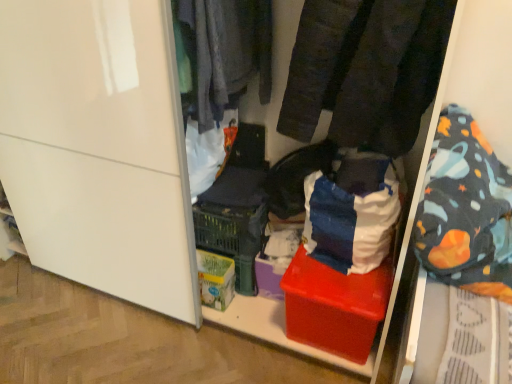
Question: From the image's perspective, is velvet-like black pants at center, the second clothing when ordered from left to right, below dark gray fabric at upper center, which appears as the 2th clothing when viewed from the right?

Choices:
 (A) no
 (B) yes

Answer: (B)

Question: Are velvet-like black pants at center, the 1th clothing viewed from the right, and dark gray fabric at upper center, the first clothing in the left-to-right sequence, beside each other?

Choices:
 (A) no
 (B) yes

Answer: (A)

Question: Is velvet-like black pants at center, the second clothing when ordered from left to right, wider than dark gray fabric at upper center, which appears as the 2th clothing when viewed from the right?

Choices:
 (A) yes
 (B) no

Answer: (A)

Question: Is velvet-like black pants at center, the second clothing when ordered from left to right, bigger than dark gray fabric at upper center, the first clothing in the left-to-right sequence?

Choices:
 (A) yes
 (B) no

Answer: (A)

Question: Does velvet-like black pants at center, the second clothing when ordered from left to right, have a lesser height compared to dark gray fabric at upper center, which appears as the 2th clothing when viewed from the right?

Choices:
 (A) yes
 (B) no

Answer: (B)

Question: In terms of height, does red plastic box at center look taller or shorter compared to velvet-like black pants at center, the 1th clothing viewed from the right?

Choices:
 (A) short
 (B) tall

Answer: (A)

Question: In terms of width, does red plastic box at center look wider or thinner when compared to velvet-like black pants at center, the 1th clothing viewed from the right?

Choices:
 (A) thin
 (B) wide

Answer: (B)

Question: From a real-world perspective, relative to velvet-like black pants at center, the 1th clothing viewed from the right, is red plastic box at center vertically above or below?

Choices:
 (A) above
 (B) below

Answer: (B)

Question: Is red plastic box at center situated inside velvet-like black pants at center, the 1th clothing viewed from the right, or outside?

Choices:
 (A) outside
 (B) inside

Answer: (A)

Question: Is red plastic box at center to the left or to the right of red plastic storage bin at center in the image?

Choices:
 (A) left
 (B) right

Answer: (B)

Question: Considering their positions, is red plastic box at center located in front of or behind red plastic storage bin at center?

Choices:
 (A) behind
 (B) front

Answer: (A)

Question: From the image's perspective, relative to red plastic storage bin at center, is red plastic box at center above or below?

Choices:
 (A) below
 (B) above

Answer: (A)

Question: From a real-world perspective, is red plastic box at center physically located above or below red plastic storage bin at center?

Choices:
 (A) above
 (B) below

Answer: (B)

Question: From the image's perspective, is red plastic storage bin at center located above or below velvet-like black pants at center, the 1th clothing viewed from the right?

Choices:
 (A) below
 (B) above

Answer: (A)

Question: From their relative heights in the image, would you say red plastic storage bin at center is taller or shorter than velvet-like black pants at center, the second clothing when ordered from left to right?

Choices:
 (A) tall
 (B) short

Answer: (A)